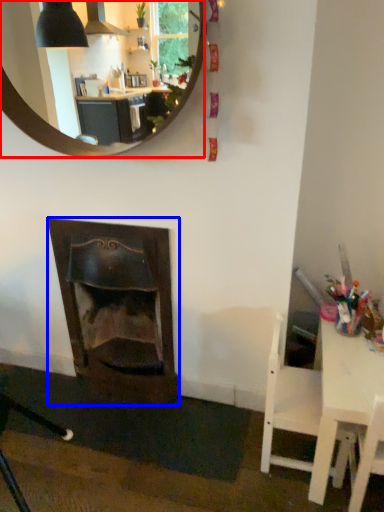
Question: Which object appears closest to the camera in this image, mirror (highlighted by a red box) or fireplace (highlighted by a blue box)?

Choices:
 (A) mirror
 (B) fireplace

Answer: (A)